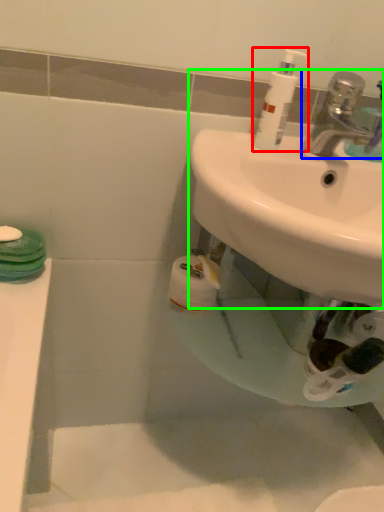
Question: Based on their relative distances, which object is farther from cleaning product (highlighted by a red box)? Choose from tap (highlighted by a blue box) and sink (highlighted by a green box).

Choices:
 (A) tap
 (B) sink

Answer: (B)